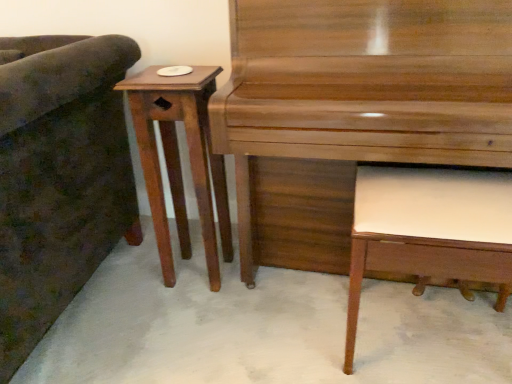
This screenshot has width=512, height=384. Find the location of `free region under white leather music stool at lower right (from a real-world perspective)`. free region under white leather music stool at lower right (from a real-world perspective) is located at coordinates (435, 359).